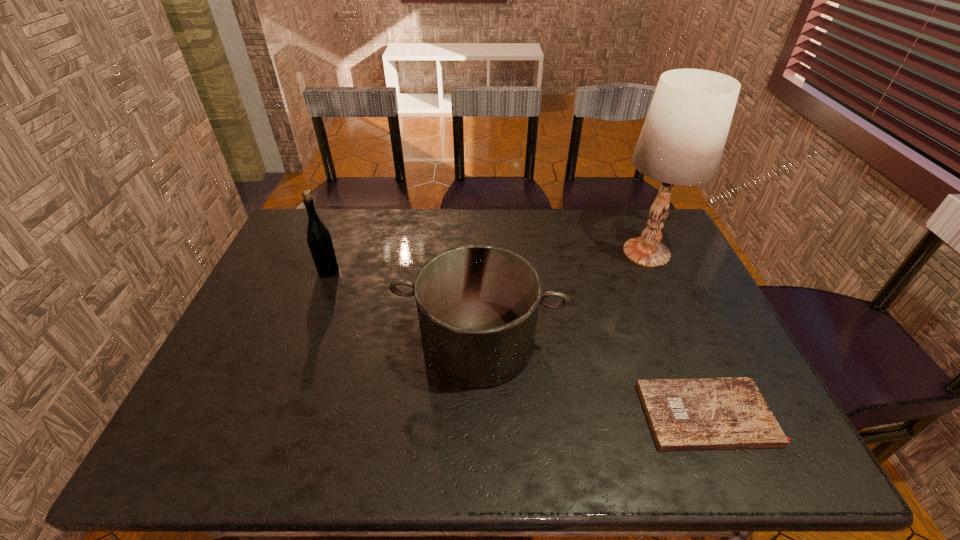
The image size is (960, 540). Identify the location of vacant space at the far left corner of the desktop. (331, 213).

Where is `free space at the near left corner`? Image resolution: width=960 pixels, height=540 pixels. free space at the near left corner is located at coordinates (175, 447).

In the image, there is a desktop. Where is `blank space at the far right corner`? The width and height of the screenshot is (960, 540). blank space at the far right corner is located at coordinates (664, 237).

Locate an element on the screen. vacant region between the Bible and the pan is located at coordinates (593, 378).

The image size is (960, 540). Find the location of `free spot between the third tallest object and the second tallest object`. free spot between the third tallest object and the second tallest object is located at coordinates coord(403,307).

The image size is (960, 540). What are the coordinates of `free space between the second object from left to right and the second tallest object` in the screenshot? It's located at (403, 307).

Where is `free spot between the shortest object and the lamp`? free spot between the shortest object and the lamp is located at coordinates click(678, 334).

Locate an element on the screen. free space between the pan and the leftmost object is located at coordinates (403, 307).

Image resolution: width=960 pixels, height=540 pixels. Identify the location of object that ranks as the third closest to the second object from left to right. (682, 140).

Select which object is the third closest to the second shortest object. Please provide its 2D coordinates. Your answer should be formatted as a tuple, i.e. [(x, y)], where the tuple contains the x and y coordinates of a point satisfying the conditions above.

[(682, 140)]